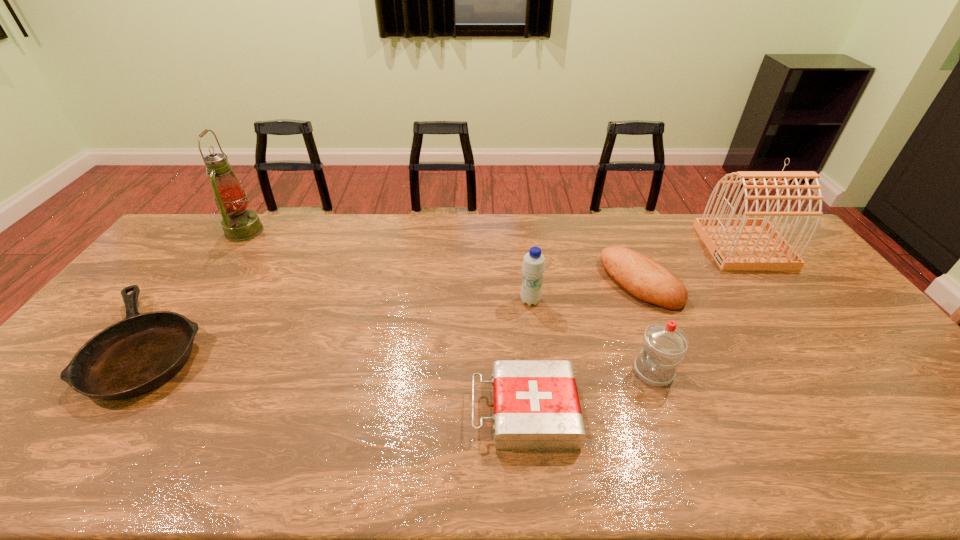
Identify the location of the third closest object relative to the frying pan. The height and width of the screenshot is (540, 960). (533, 267).

I want to click on blank area in the image that satisfies the following two spatial constraints: 1. on the back side of the frying pan; 2. on the left side of the bread, so tap(195, 283).

Where is `free location that satisfies the following two spatial constraints: 1. on the front side of the oil lamp; 2. on the left side of the farther water bottle`? The image size is (960, 540). free location that satisfies the following two spatial constraints: 1. on the front side of the oil lamp; 2. on the left side of the farther water bottle is located at coordinates (196, 301).